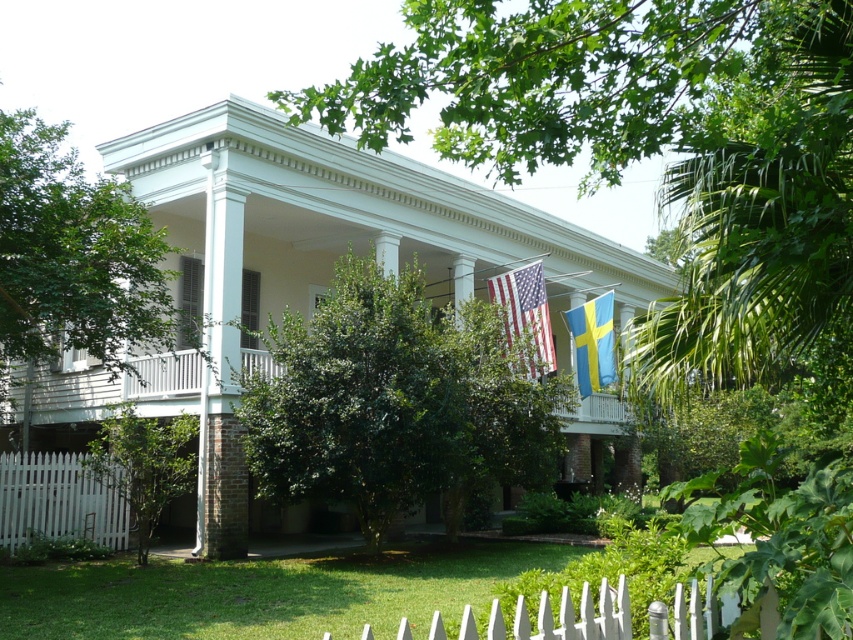
You are a painter hired to paint the white picket fence at lower left and the american flag at center. Which object requires a ladder to paint because it is taller?

The white picket fence at lower left requires a ladder because it is much taller than the american flag at center.

Based on the scene description, where is the white picket fence at lower left located in terms of its 2D coordinates?

The white picket fence at lower left is located at the 2D coordinates of point [57,500].

You are standing in front of the house and want to walk towards the white picket fence at lower center and the white picket fence at lower left. Which one is closer to you?

The white picket fence at lower left is closer to you because it is located below the white picket fence at lower center, meaning it is nearer in the viewer perspective.